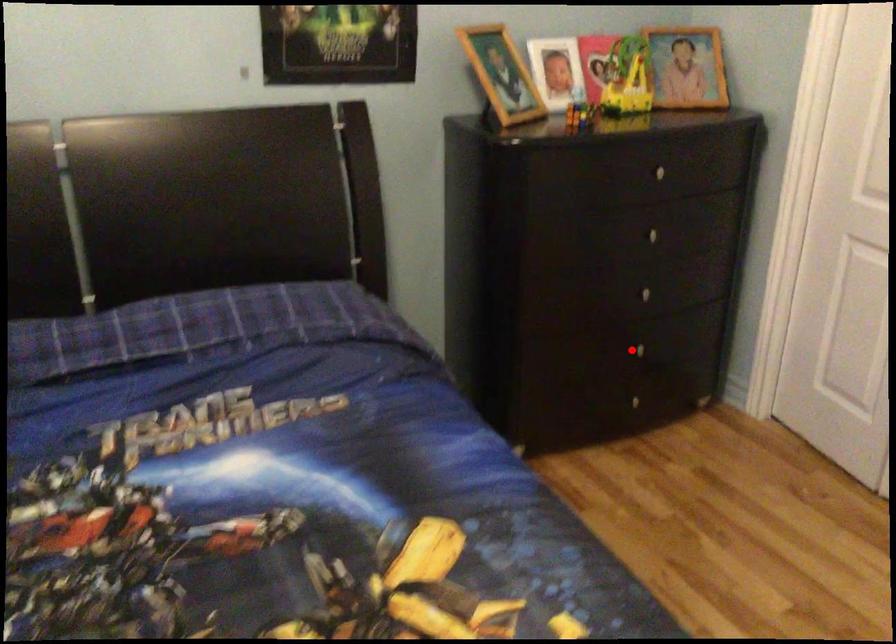
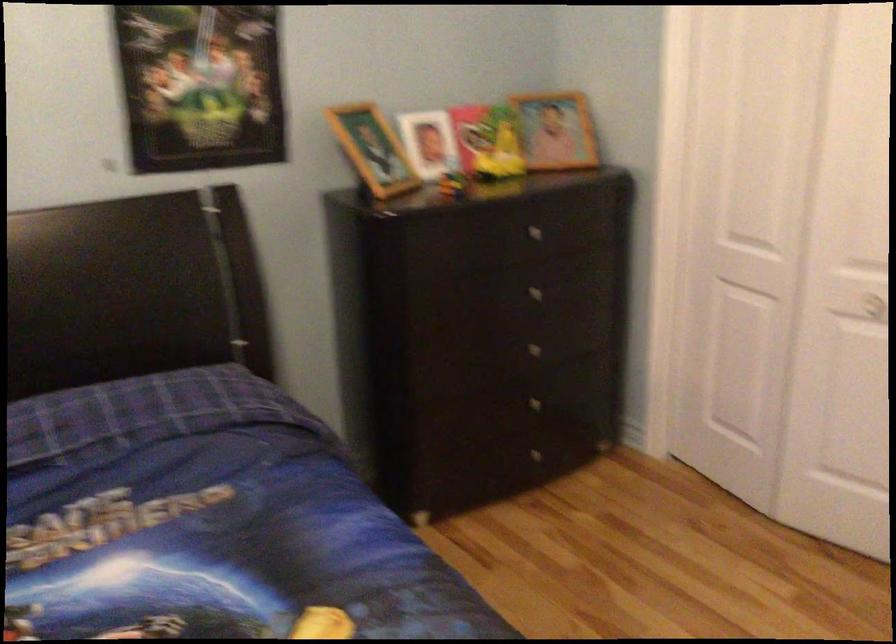
Find the pixel in the second image that matches the highlighted location in the first image.

(528, 406)